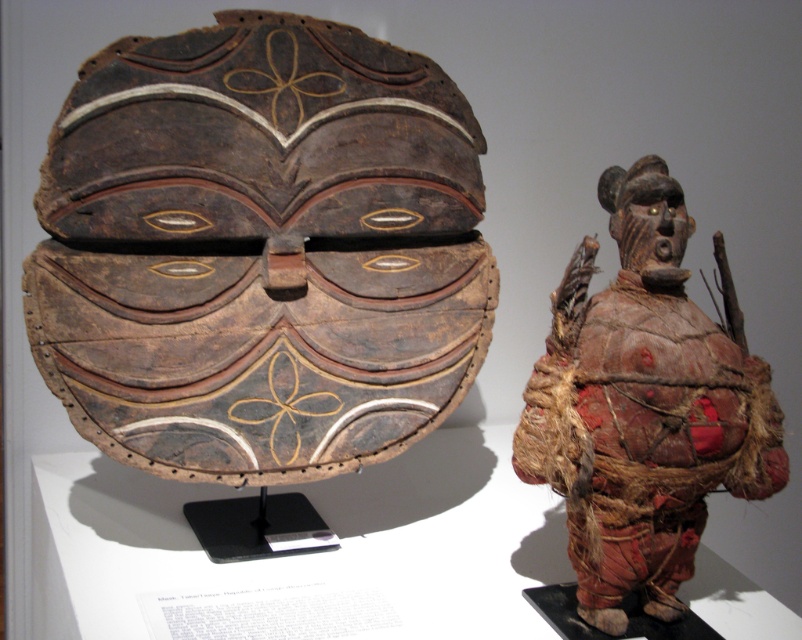
Who is more forward, (420, 412) or (630, 278)?

Point (630, 278) is in front.

Image resolution: width=802 pixels, height=640 pixels. What do you see at coordinates (258, 250) in the screenshot? I see `brown carved wood helmet at upper left` at bounding box center [258, 250].

Which is behind, point (189, 412) or point (699, 474)?

The point (189, 412) is more distant.

Identify the location of brown carved wood helmet at upper left. (258, 250).